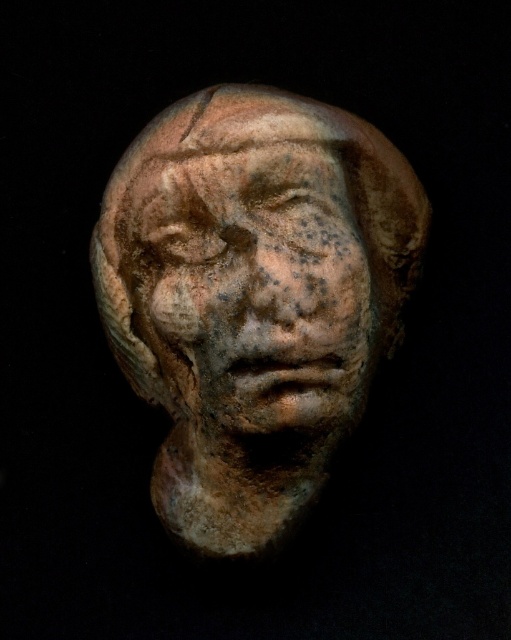
Does matte clay head at center have a smaller size compared to earthenware sculpture at center?

Incorrect, matte clay head at center is not smaller in size than earthenware sculpture at center.

The image size is (511, 640). Describe the element at coordinates (253, 298) in the screenshot. I see `matte clay head at center` at that location.

What do you see at coordinates (253, 298) in the screenshot? I see `matte clay head at center` at bounding box center [253, 298].

Identify the location of matte clay head at center. This screenshot has width=511, height=640. (253, 298).